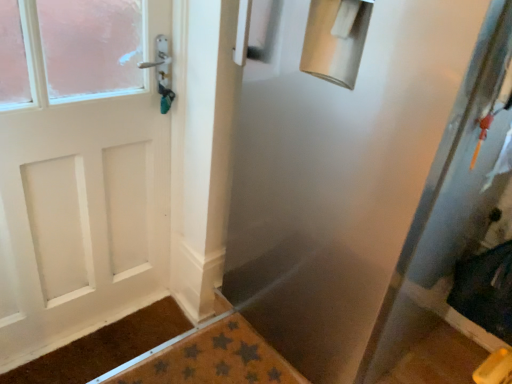
At what (x,y) coordinates should I click in order to perform the action: click on vacant space situated above brown textured mat at lower left (from a real-world perspective). Please return your answer as a coordinate pair (x, y). This screenshot has width=512, height=384. Looking at the image, I should click on (105, 347).